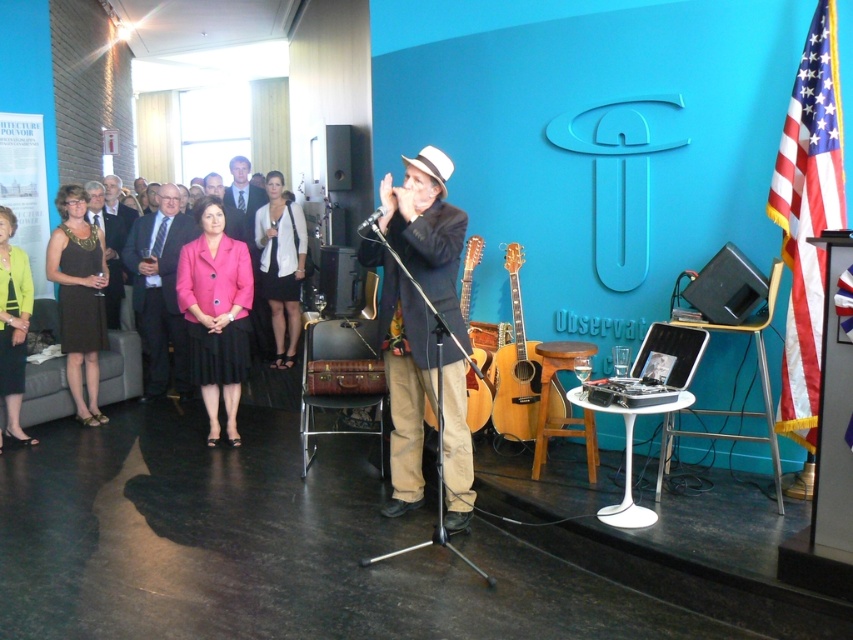
Which is more to the left, white matte blazer at center or matte black suit at center?

matte black suit at center

Is white matte blazer at center to the right of matte black suit at center from the viewer's perspective?

Indeed, white matte blazer at center is positioned on the right side of matte black suit at center.

Locate an element on the screen. The height and width of the screenshot is (640, 853). white matte blazer at center is located at coordinates (281, 264).

Describe the element at coordinates (515, 368) in the screenshot. The image size is (853, 640). I see `light brown wooden guitar at center` at that location.

Is point (503, 385) more distant than point (114, 304)?

No, it is in front of (114, 304).

Is point (506, 429) more distant than point (107, 227)?

No, (506, 429) is closer to viewer.

Locate an element on the screen. The height and width of the screenshot is (640, 853). light brown wooden guitar at center is located at coordinates (515, 368).

Between point (221, 284) and point (3, 330), which one is positioned in front?

Point (3, 330)

Does pink fabric skirt at center have a lesser height compared to matte yellow blazer at left?

No.

What are the coordinates of `pink fabric skirt at center` in the screenshot? It's located at (216, 314).

Where is `pink fabric skirt at center`? The image size is (853, 640). pink fabric skirt at center is located at coordinates (216, 314).